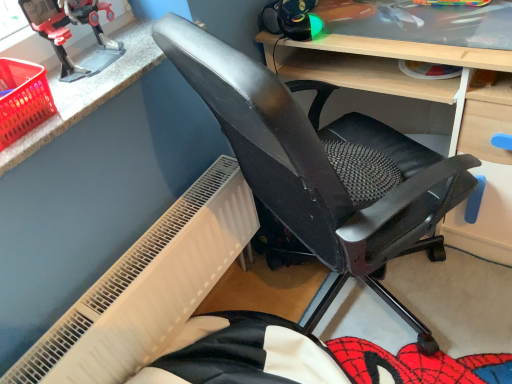
You are a GUI agent. You are given a task and a screenshot of the screen. Output one action in this format:
    pyautogui.click(x=<x>, y=<y>)
    Task: Click on the empty space that is to the right of metallic plastic toy robot at upper left
    The height and width of the screenshot is (384, 512).
    Given the screenshot: What is the action you would take?
    pyautogui.click(x=143, y=55)